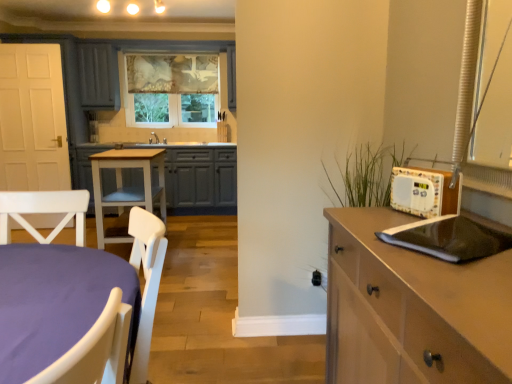
Question: From the image's perspective, is black matte laptop at right on top of light brown wood cabinet at right, the first cabinetry viewed from the front?

Choices:
 (A) no
 (B) yes

Answer: (B)

Question: Does black matte laptop at right appear on the left side of light brown wood cabinet at right, placed as the first cabinetry when sorted from right to left?

Choices:
 (A) yes
 (B) no

Answer: (B)

Question: From a real-world perspective, is black matte laptop at right beneath light brown wood cabinet at right, positioned as the 2th cabinetry in back-to-front order?

Choices:
 (A) no
 (B) yes

Answer: (A)

Question: Is black matte laptop at right shorter than light brown wood cabinet at right, which ranks as the 1th cabinetry in bottom-to-top order?

Choices:
 (A) yes
 (B) no

Answer: (A)

Question: From a real-world perspective, does black matte laptop at right stand above light brown wood cabinet at right, which ranks as the 1th cabinetry in bottom-to-top order?

Choices:
 (A) yes
 (B) no

Answer: (A)

Question: Is black matte laptop at right turned away from light brown wood cabinet at right, the first cabinetry viewed from the front?

Choices:
 (A) yes
 (B) no

Answer: (B)

Question: Considering the relative sizes of textured fabric window at center and matte gray cabinet at center, the 2th cabinetry when ordered from bottom to top, in the image provided, is textured fabric window at center bigger than matte gray cabinet at center, the 2th cabinetry when ordered from bottom to top,?

Choices:
 (A) yes
 (B) no

Answer: (B)

Question: Is textured fabric window at center to the left of matte gray cabinet at center, the 2th cabinetry when ordered from bottom to top, from the viewer's perspective?

Choices:
 (A) no
 (B) yes

Answer: (A)

Question: Does textured fabric window at center have a lesser width compared to matte gray cabinet at center, the 2th cabinetry when ordered from bottom to top?

Choices:
 (A) no
 (B) yes

Answer: (B)

Question: Is textured fabric window at center positioned with its back to matte gray cabinet at center, which ranks as the first cabinetry in left-to-right order?

Choices:
 (A) yes
 (B) no

Answer: (B)

Question: Is textured fabric window at center taller than matte gray cabinet at center, which ranks as the first cabinetry in left-to-right order?

Choices:
 (A) no
 (B) yes

Answer: (B)

Question: Can you confirm if textured fabric window at center is smaller than matte gray cabinet at center, arranged as the second cabinetry when viewed from the right?

Choices:
 (A) yes
 (B) no

Answer: (A)

Question: From the image's perspective, is white wood table at center below black matte laptop at right?

Choices:
 (A) yes
 (B) no

Answer: (B)